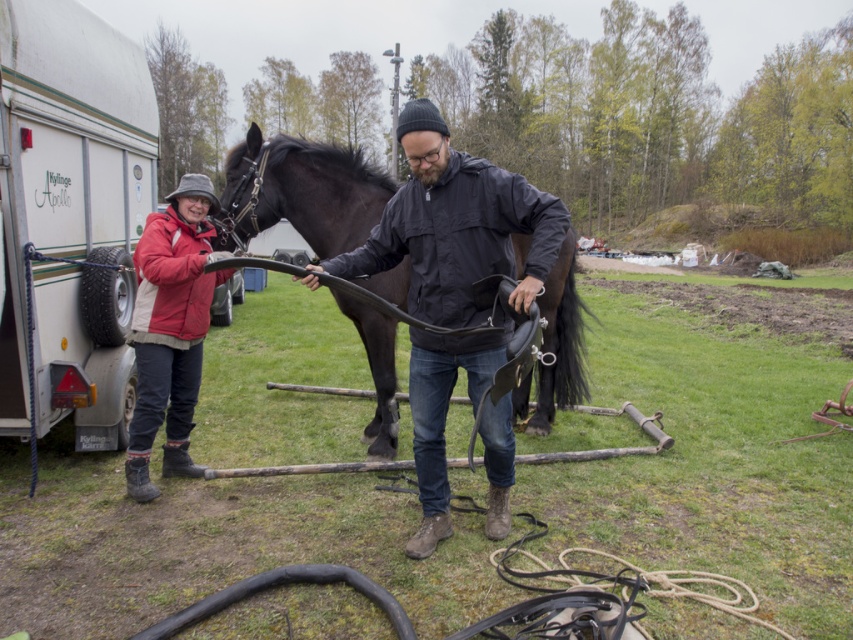
Based on the photo, can you confirm if white plastic trailer at left is positioned above red woolen jacket at left?

Yes, white plastic trailer at left is above red woolen jacket at left.

Is white plastic trailer at left taller than red woolen jacket at left?

Correct, white plastic trailer at left is much taller as red woolen jacket at left.

This screenshot has height=640, width=853. What do you see at coordinates (67, 157) in the screenshot?
I see `white plastic trailer at left` at bounding box center [67, 157].

Image resolution: width=853 pixels, height=640 pixels. Identify the location of white plastic trailer at left. (67, 157).

Describe the element at coordinates (67, 157) in the screenshot. The width and height of the screenshot is (853, 640). I see `white plastic trailer at left` at that location.

Between point (138, 154) and point (569, 269), which one is positioned behind?

The point (138, 154) is behind.

This screenshot has width=853, height=640. I want to click on white plastic trailer at left, so click(67, 157).

Find the location of a particular element. The image size is (853, 640). shiny black horse at center is located at coordinates (300, 193).

Does shiny black horse at center have a lesser height compared to red woolen jacket at left?

Yes, shiny black horse at center is shorter than red woolen jacket at left.

Where is `shiny black horse at center`? shiny black horse at center is located at coordinates (300, 193).

I want to click on shiny black horse at center, so click(x=300, y=193).